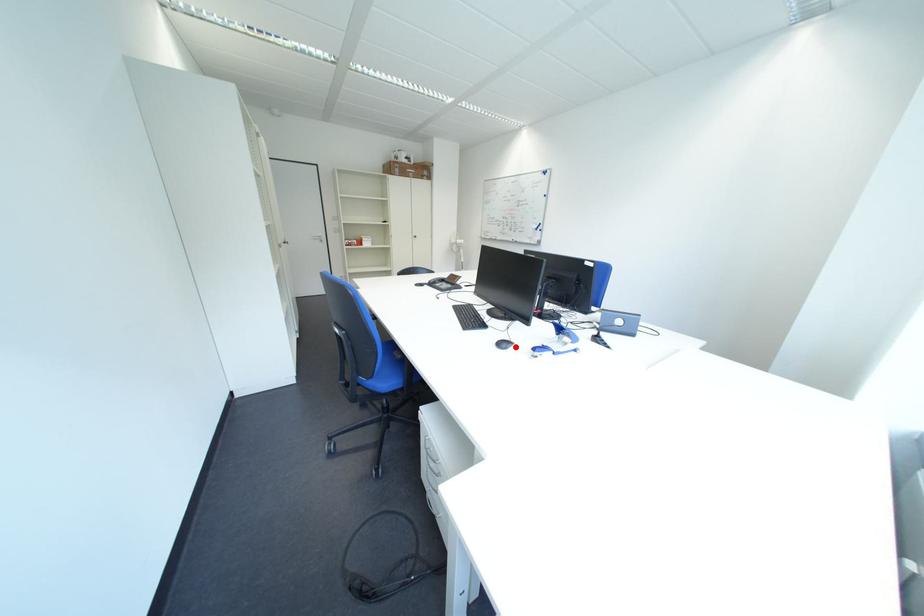
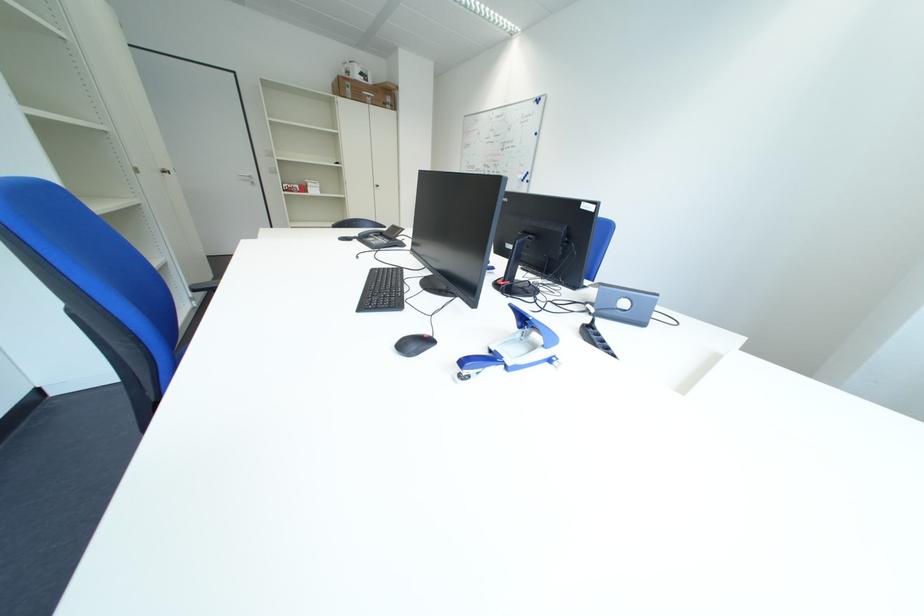
The point at the highlighted location is marked in the first image. Where is the corresponding point in the second image?

(426, 346)